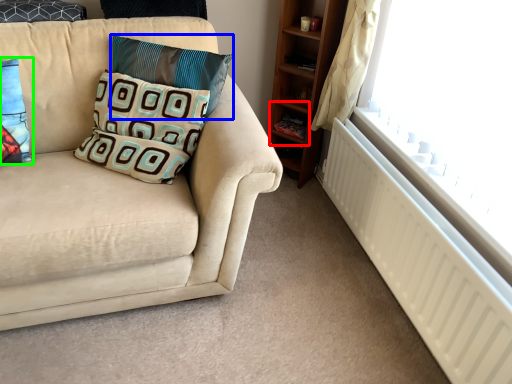
Question: Which is nearer to the shelf (highlighted by a red box)? pillow (highlighted by a blue box) or pillow (highlighted by a green box).

Choices:
 (A) pillow
 (B) pillow

Answer: (A)